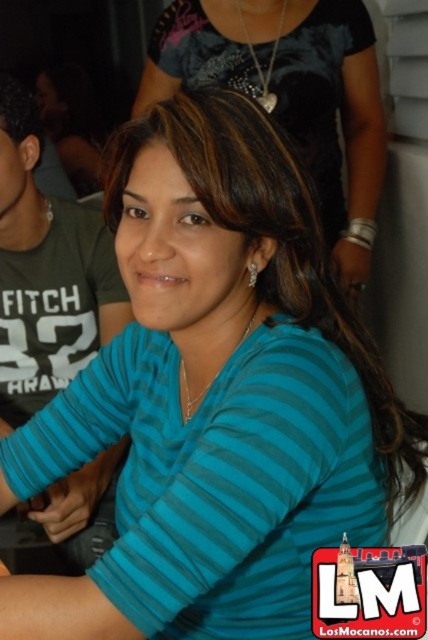
Question: Among these objects, which one is nearest to the camera?

Choices:
 (A) green cotton shirt at left
 (B) blue striped shirt at center

Answer: (A)

Question: Can you confirm if blue striped shirt at center is positioned below green cotton shirt at left?

Choices:
 (A) yes
 (B) no

Answer: (B)

Question: Does blue striped shirt at center have a smaller size compared to green cotton shirt at left?

Choices:
 (A) no
 (B) yes

Answer: (A)

Question: In this image, where is blue striped shirt at center located relative to green cotton shirt at left?

Choices:
 (A) left
 (B) right

Answer: (B)